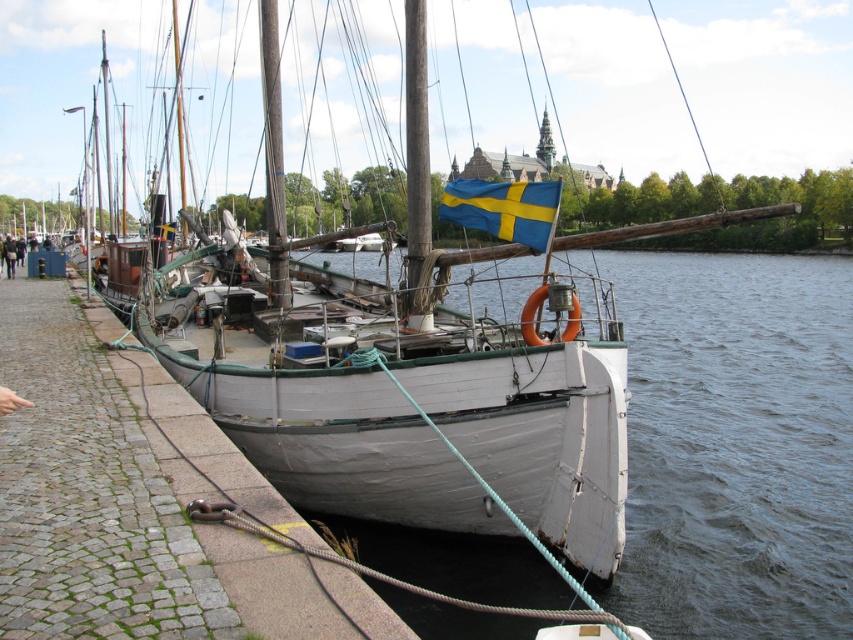
Is white matte water at lower center above gray stone dock at lower left?

Correct, white matte water at lower center is located above gray stone dock at lower left.

Which is in front, point (635, 314) or point (97, 612)?

Positioned in front is point (97, 612).

Locate an element on the screen. white matte water at lower center is located at coordinates coord(735,444).

Where is `white matte water at lower center`? This screenshot has width=853, height=640. white matte water at lower center is located at coordinates (735, 444).

Which is below, gray stone dock at lower left or blue/yellow fabric flag at upper center?

gray stone dock at lower left is below.

Is the position of gray stone dock at lower left less distant than that of blue/yellow fabric flag at upper center?

Yes, gray stone dock at lower left is in front of blue/yellow fabric flag at upper center.

Between point (112, 561) and point (535, 241), which one is positioned behind?

Positioned behind is point (535, 241).

Locate an element on the screen. gray stone dock at lower left is located at coordinates (117, 500).

Does point (796, 609) lie in front of point (500, 202)?

Yes, it is in front of point (500, 202).

Can you confirm if white matte water at lower center is thinner than blue/yellow fabric flag at upper center?

No.

Is point (660, 499) positioned before point (498, 192)?

No, (660, 499) is further to viewer.

At what (x,y) coordinates should I click in order to perform the action: click on white matte water at lower center. Please return your answer as a coordinate pair (x, y). Looking at the image, I should click on (735, 444).